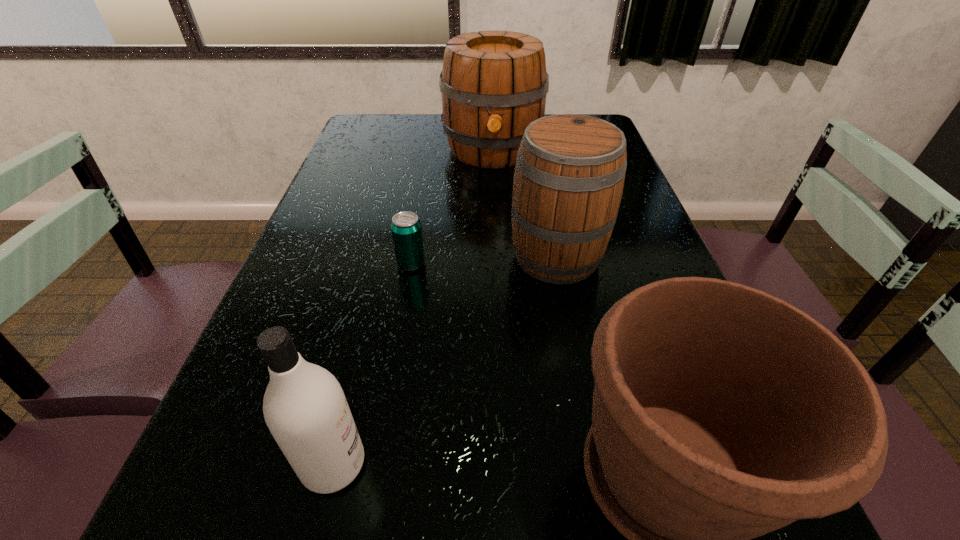
Find the location of a particular element. The height and width of the screenshot is (540, 960). object that ranks as the fourth closest to the flowerpot is located at coordinates (493, 83).

This screenshot has height=540, width=960. In order to click on free space that satisfies the following two spatial constraints: 1. on the side of the nearer cider where the spigot is located; 2. on the left side of the farthest object in this screenshot , I will do `click(497, 256)`.

What are the coordinates of `blank space that satisfies the following two spatial constraints: 1. on the front side of the nearer cider; 2. on the front-facing side of the shampoo` in the screenshot? It's located at (597, 464).

Locate an element on the screen. This screenshot has height=540, width=960. blank space that satisfies the following two spatial constraints: 1. on the side of the farther cider where the spigot is located; 2. on the front-facing side of the shampoo is located at coordinates (507, 464).

The width and height of the screenshot is (960, 540). What are the coordinates of `free space that satisfies the following two spatial constraints: 1. on the side of the nearer cider where the spigot is located; 2. on the right side of the farthest object` in the screenshot? It's located at (497, 256).